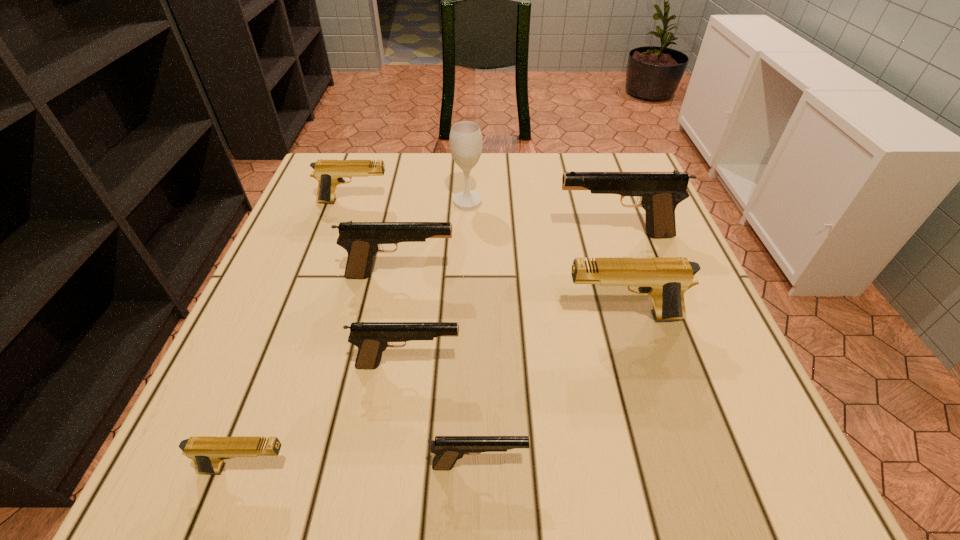
I want to click on tan pistol that is the second closest one to the third smallest black pistol, so click(x=328, y=173).

Image resolution: width=960 pixels, height=540 pixels. In order to click on the second closest tan pistol relative to the farthest black pistol in this screenshot , I will do `click(328, 173)`.